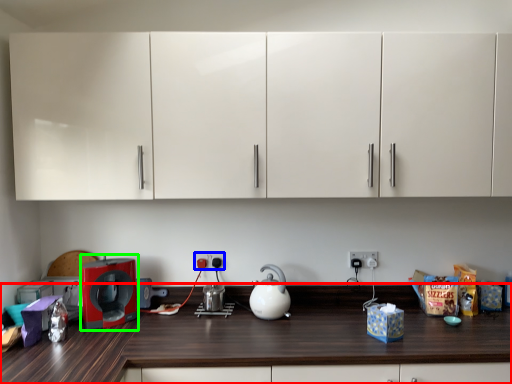
Question: Considering the real-world distances, which object is farthest from countertop (highlighted by a red box)? electric outlet (highlighted by a blue box) or home appliance (highlighted by a green box)?

Choices:
 (A) electric outlet
 (B) home appliance

Answer: (A)